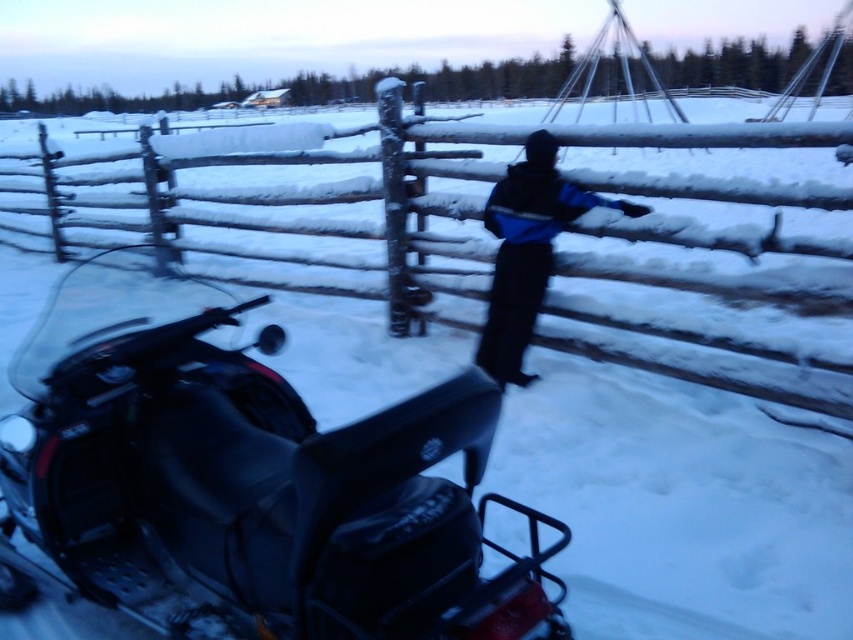
Question: Estimate the real-world distances between objects in this image. Which object is farther from the snow-covered wooden fence at center?

Choices:
 (A) matte black snowmobile at lower left
 (B) dark blue jacket at center

Answer: (A)

Question: Among these objects, which one is farthest from the camera?

Choices:
 (A) dark blue jacket at center
 (B) matte black snowmobile at lower left
 (C) snow-covered wooden fence at center

Answer: (C)

Question: Is matte black snowmobile at lower left smaller than dark blue jacket at center?

Choices:
 (A) no
 (B) yes

Answer: (A)

Question: Which point is closer to the camera taking this photo?

Choices:
 (A) (508, 285)
 (B) (444, 164)

Answer: (A)

Question: Can you confirm if snow-covered wooden fence at center is thinner than dark blue jacket at center?

Choices:
 (A) yes
 (B) no

Answer: (A)

Question: Does matte black snowmobile at lower left appear on the left side of dark blue jacket at center?

Choices:
 (A) yes
 (B) no

Answer: (A)